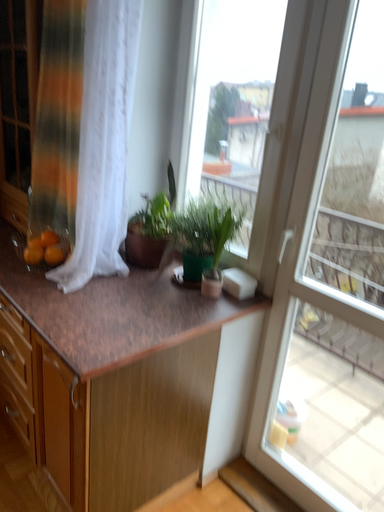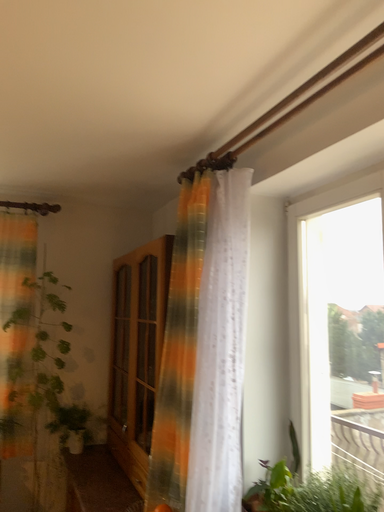
Question: Which way did the camera rotate in the video?

Choices:
 (A) rotated left
 (B) rotated right

Answer: (A)